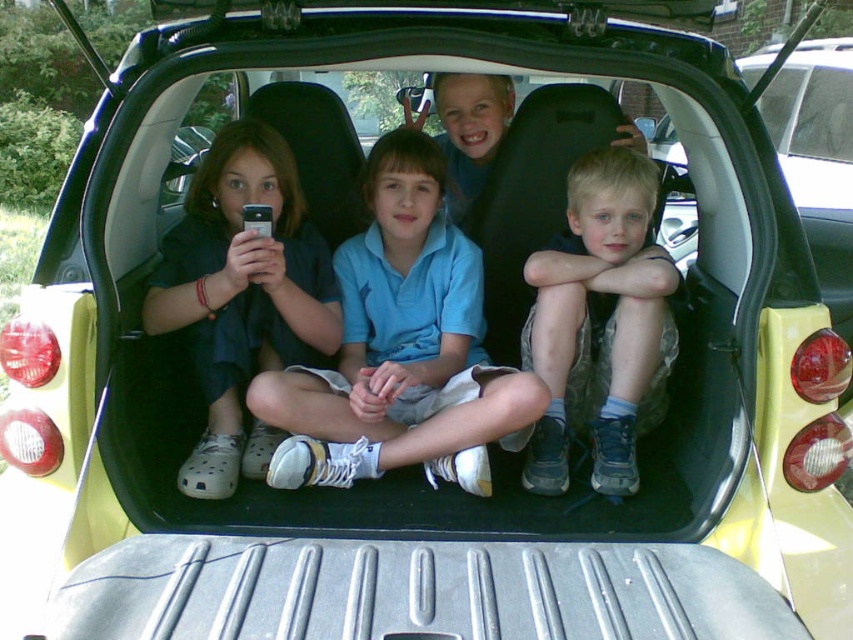
Does blue cotton shirt at center have a greater height compared to blue fabric shorts at center?

Correct, blue cotton shirt at center is much taller as blue fabric shorts at center.

Which is in front, point (351, 476) or point (561, 369)?

Point (351, 476) is more forward.

Find the location of a particular element. blue cotton shirt at center is located at coordinates (398, 342).

Who is positioned more to the right, matte black shirt at center or blue fabric shorts at center?

From the viewer's perspective, blue fabric shorts at center appears more on the right side.

Which is above, matte black shirt at center or blue fabric shorts at center?

matte black shirt at center

Does point (276, 136) lie in front of point (625, 298)?

No, it is not.

Where is `matte black shirt at center`? The image size is (853, 640). matte black shirt at center is located at coordinates (242, 296).

Is point (434, 228) positioned behind point (277, 240)?

Yes, point (434, 228) is behind point (277, 240).

Looking at this image, can you confirm if blue cotton shirt at center is positioned above matte black shirt at center?

No.

Does point (387, 257) come in front of point (218, 333)?

No, (387, 257) is further to viewer.

Find the location of `blue cotton shirt at center`. blue cotton shirt at center is located at coordinates pos(398,342).